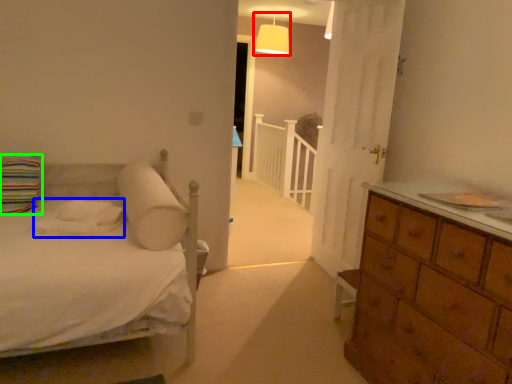
Question: Considering the real-world distances, which object is closest to lamp (highlighted by a red box)? sheet (highlighted by a blue box) or pillow (highlighted by a green box).

Choices:
 (A) sheet
 (B) pillow

Answer: (B)